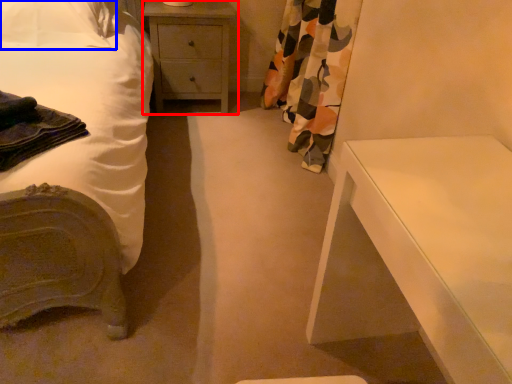
Question: Which object appears closest to the camera in this image, chest of drawers (highlighted by a red box) or pillow (highlighted by a blue box)?

Choices:
 (A) chest of drawers
 (B) pillow

Answer: (B)